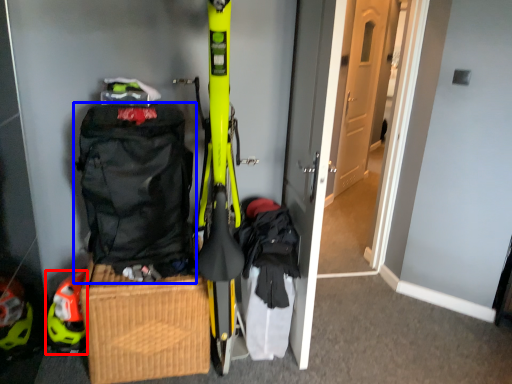
Question: Which object is further to the camera taking this photo, helmet (highlighted by a red box) or backpack (highlighted by a blue box)?

Choices:
 (A) helmet
 (B) backpack

Answer: (A)